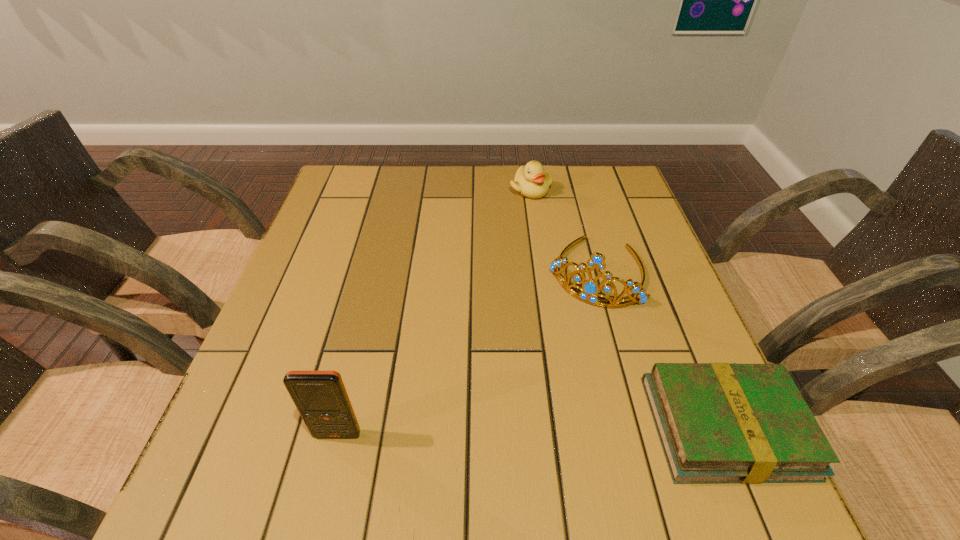
Identify the location of vacant area that lies between the book and the leftmost object. This screenshot has width=960, height=540. (531, 430).

Locate an element on the screen. free point between the second tallest object and the book is located at coordinates (660, 349).

In order to click on free spot between the duckling and the book in this screenshot , I will do `click(628, 308)`.

I want to click on vacant space in between the second shortest object and the book, so click(x=628, y=308).

I want to click on free space between the second farthest object and the farthest object, so click(x=564, y=231).

Image resolution: width=960 pixels, height=540 pixels. What are the coordinates of `free space between the tiara and the shortest object` in the screenshot? It's located at (660, 349).

Locate an element on the screen. free space between the second shortest object and the shortest object is located at coordinates (628, 308).

Select which object is the closest to the second farthest object. Please provide its 2D coordinates. Your answer should be formatted as a tuple, i.e. [(x, y)], where the tuple contains the x and y coordinates of a point satisfying the conditions above.

[(531, 181)]

Locate which object is the second closest to the tiara. Please provide its 2D coordinates. Your answer should be formatted as a tuple, i.e. [(x, y)], where the tuple contains the x and y coordinates of a point satisfying the conditions above.

[(717, 422)]

At what (x,y) coordinates should I click in order to perform the action: click on free space that satisfies the following two spatial constraints: 1. on the front side of the shortest object; 2. on the left side of the second tallest object. Please return your answer as a coordinate pair (x, y). This screenshot has height=540, width=960. Looking at the image, I should click on (639, 427).